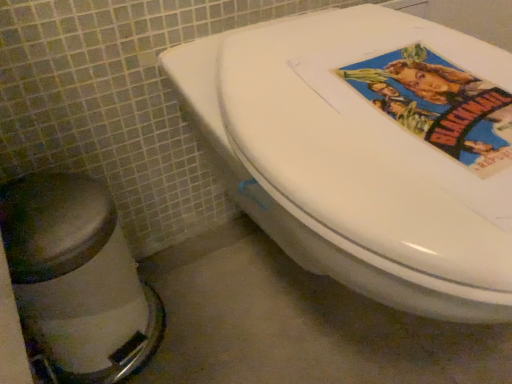
You are a GUI agent. You are given a task and a screenshot of the screen. Output one action in this format:
    pyautogui.click(x=<x>, y=<y>)
    Task: Click on the vacant area on top of brushed metal bidet at lower left (from a real-world perspective)
    The image size is (512, 384).
    Given the screenshot: What is the action you would take?
    pyautogui.click(x=52, y=211)